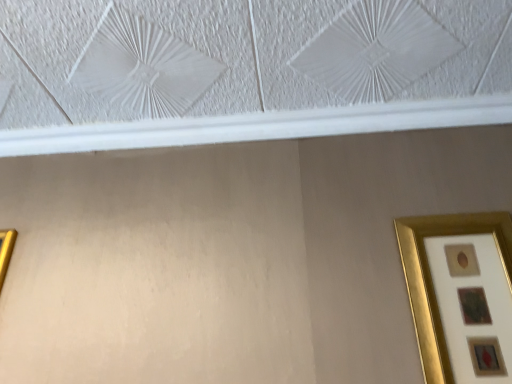
The width and height of the screenshot is (512, 384). In order to click on gold metallic picture frame at right, the 2th picture frame in the left-to-right sequence in this screenshot , I will do `click(460, 294)`.

The width and height of the screenshot is (512, 384). What do you see at coordinates (460, 294) in the screenshot?
I see `gold metallic picture frame at right, which is the first picture frame in right-to-left order` at bounding box center [460, 294].

At what (x,y) coordinates should I click in order to perform the action: click on gold metallic picture frame at left, positioned as the 2th picture frame in right-to-left order. Please return your answer as a coordinate pair (x, y). Looking at the image, I should click on (6, 251).

This screenshot has height=384, width=512. What do you see at coordinates (6, 251) in the screenshot? I see `gold metallic picture frame at left, positioned as the 2th picture frame in right-to-left order` at bounding box center [6, 251].

Where is `gold metallic picture frame at right, which is the first picture frame in right-to-left order`? The height and width of the screenshot is (384, 512). gold metallic picture frame at right, which is the first picture frame in right-to-left order is located at coordinates (460, 294).

Which object is positioned more to the right, gold metallic picture frame at right, the 2th picture frame in the left-to-right sequence, or gold metallic picture frame at left, positioned as the 2th picture frame in right-to-left order?

gold metallic picture frame at right, the 2th picture frame in the left-to-right sequence.

Does gold metallic picture frame at right, which is the first picture frame in right-to-left order, come in front of gold metallic picture frame at left, positioned as the 2th picture frame in right-to-left order?

Yes.

Is point (443, 284) less distant than point (4, 232)?

That is True.

In the scene shown: From the image's perspective, is gold metallic picture frame at right, which is the first picture frame in right-to-left order, above gold metallic picture frame at left, positioned as the 2th picture frame in right-to-left order?

Correct, gold metallic picture frame at right, which is the first picture frame in right-to-left order, appears higher than gold metallic picture frame at left, positioned as the 2th picture frame in right-to-left order, in the image.

From a real-world perspective, which object rests below the other?

In real-world perspective, gold metallic picture frame at right, the 2th picture frame in the left-to-right sequence, is lower.

Between gold metallic picture frame at right, which is the first picture frame in right-to-left order, and gold metallic picture frame at left, positioned as the 2th picture frame in right-to-left order, which one has larger width?

Wider between the two is gold metallic picture frame at right, which is the first picture frame in right-to-left order.

Which of these two, gold metallic picture frame at right, the 2th picture frame in the left-to-right sequence, or gold metallic picture frame at left, acting as the 1th picture frame starting from the left, stands taller?

With more height is gold metallic picture frame at right, the 2th picture frame in the left-to-right sequence.

Can you confirm if gold metallic picture frame at right, the 2th picture frame in the left-to-right sequence, is bigger than gold metallic picture frame at left, positioned as the 2th picture frame in right-to-left order?

Actually, gold metallic picture frame at right, the 2th picture frame in the left-to-right sequence, might be smaller than gold metallic picture frame at left, positioned as the 2th picture frame in right-to-left order.

Is gold metallic picture frame at left, acting as the 1th picture frame starting from the left, surrounded by gold metallic picture frame at right, which is the first picture frame in right-to-left order?

No, gold metallic picture frame at left, acting as the 1th picture frame starting from the left, is not surrounded by gold metallic picture frame at right, which is the first picture frame in right-to-left order.

Is gold metallic picture frame at right, the 2th picture frame in the left-to-right sequence, not near gold metallic picture frame at left, positioned as the 2th picture frame in right-to-left order?

No, gold metallic picture frame at right, the 2th picture frame in the left-to-right sequence, is not far from gold metallic picture frame at left, positioned as the 2th picture frame in right-to-left order.

Could you tell me if gold metallic picture frame at right, the 2th picture frame in the left-to-right sequence, is facing gold metallic picture frame at left, acting as the 1th picture frame starting from the left?

No, gold metallic picture frame at right, the 2th picture frame in the left-to-right sequence, is not aimed at gold metallic picture frame at left, acting as the 1th picture frame starting from the left.

In the image, there is a gold metallic picture frame at right, which is the first picture frame in right-to-left order. Where is `picture frame below it (from the image's perspective)`? Image resolution: width=512 pixels, height=384 pixels. picture frame below it (from the image's perspective) is located at coordinates (6, 251).

Considering the positions of objects gold metallic picture frame at left, acting as the 1th picture frame starting from the left, and gold metallic picture frame at right, the 2th picture frame in the left-to-right sequence, in the image provided, who is more to the left, gold metallic picture frame at left, acting as the 1th picture frame starting from the left, or gold metallic picture frame at right, the 2th picture frame in the left-to-right sequence,?

Positioned to the left is gold metallic picture frame at left, acting as the 1th picture frame starting from the left.

Relative to gold metallic picture frame at right, the 2th picture frame in the left-to-right sequence, is gold metallic picture frame at left, acting as the 1th picture frame starting from the left, in front or behind?

gold metallic picture frame at left, acting as the 1th picture frame starting from the left, is positioned farther from the viewer than gold metallic picture frame at right, the 2th picture frame in the left-to-right sequence.

Is point (0, 240) more distant than point (417, 219)?

Yes, it is behind point (417, 219).

From the image's perspective, is gold metallic picture frame at left, acting as the 1th picture frame starting from the left, located above or below gold metallic picture frame at right, which is the first picture frame in right-to-left order?

Clearly, from the image's perspective, gold metallic picture frame at left, acting as the 1th picture frame starting from the left, is below gold metallic picture frame at right, which is the first picture frame in right-to-left order.

From a real-world perspective, between gold metallic picture frame at left, positioned as the 2th picture frame in right-to-left order, and gold metallic picture frame at right, the 2th picture frame in the left-to-right sequence, who is vertically lower?

gold metallic picture frame at right, the 2th picture frame in the left-to-right sequence, from a real-world perspective.

Considering the relative sizes of gold metallic picture frame at left, acting as the 1th picture frame starting from the left, and gold metallic picture frame at right, which is the first picture frame in right-to-left order, in the image provided, is gold metallic picture frame at left, acting as the 1th picture frame starting from the left, thinner than gold metallic picture frame at right, which is the first picture frame in right-to-left order,?

Correct, the width of gold metallic picture frame at left, acting as the 1th picture frame starting from the left, is less than that of gold metallic picture frame at right, which is the first picture frame in right-to-left order.

Can you confirm if gold metallic picture frame at left, acting as the 1th picture frame starting from the left, is shorter than gold metallic picture frame at right, which is the first picture frame in right-to-left order?

Yes.

Who is bigger, gold metallic picture frame at left, positioned as the 2th picture frame in right-to-left order, or gold metallic picture frame at right, which is the first picture frame in right-to-left order?

With larger size is gold metallic picture frame at left, positioned as the 2th picture frame in right-to-left order.

Is gold metallic picture frame at left, positioned as the 2th picture frame in right-to-left order, inside the boundaries of gold metallic picture frame at right, the 2th picture frame in the left-to-right sequence, or outside?

The correct answer is: outside.

From the picture: Is gold metallic picture frame at left, positioned as the 2th picture frame in right-to-left order, far from gold metallic picture frame at right, which is the first picture frame in right-to-left order?

No.

Is gold metallic picture frame at left, acting as the 1th picture frame starting from the left, turned away from gold metallic picture frame at right, the 2th picture frame in the left-to-right sequence?

No.

How different are the orientations of gold metallic picture frame at left, acting as the 1th picture frame starting from the left, and gold metallic picture frame at right, which is the first picture frame in right-to-left order, in degrees?

0.000179 degrees separate the facing orientations of gold metallic picture frame at left, acting as the 1th picture frame starting from the left, and gold metallic picture frame at right, which is the first picture frame in right-to-left order.

Looking at this image, how much distance is there between gold metallic picture frame at left, acting as the 1th picture frame starting from the left, and gold metallic picture frame at right, which is the first picture frame in right-to-left order?

The distance of gold metallic picture frame at left, acting as the 1th picture frame starting from the left, from gold metallic picture frame at right, which is the first picture frame in right-to-left order, is 38.87 inches.

Where is `picture frame beneath the gold metallic picture frame at left, positioned as the 2th picture frame in right-to-left order (from a real-world perspective)`? This screenshot has width=512, height=384. picture frame beneath the gold metallic picture frame at left, positioned as the 2th picture frame in right-to-left order (from a real-world perspective) is located at coordinates (460, 294).

Where is `picture frame lying on the left of gold metallic picture frame at right, the 2th picture frame in the left-to-right sequence`? picture frame lying on the left of gold metallic picture frame at right, the 2th picture frame in the left-to-right sequence is located at coordinates (6, 251).

Where is `picture frame below the gold metallic picture frame at right, which is the first picture frame in right-to-left order (from the image's perspective)`? The image size is (512, 384). picture frame below the gold metallic picture frame at right, which is the first picture frame in right-to-left order (from the image's perspective) is located at coordinates (6, 251).